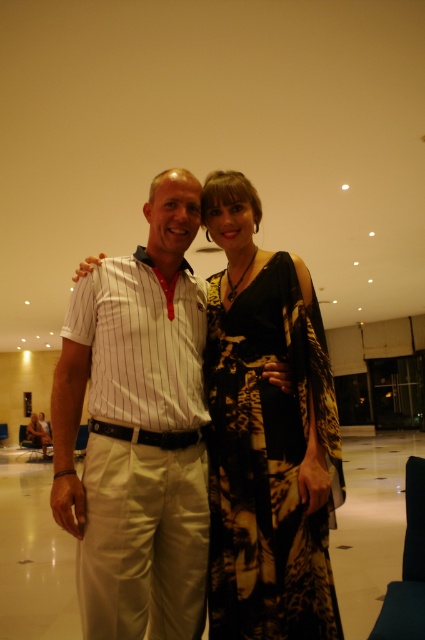
Question: Can you confirm if white striped shirt at center is wider than black printed dress at center?

Choices:
 (A) yes
 (B) no

Answer: (A)

Question: Among these objects, which one is farthest from the camera?

Choices:
 (A) black printed dress at center
 (B) white striped shirt at center

Answer: (A)

Question: Considering the relative positions of white striped shirt at center and black printed dress at center in the image provided, where is white striped shirt at center located with respect to black printed dress at center?

Choices:
 (A) above
 (B) below

Answer: (A)

Question: Is white striped shirt at center smaller than black printed dress at center?

Choices:
 (A) no
 (B) yes

Answer: (A)

Question: Which point appears closest to the camera in this image?

Choices:
 (A) (133, 577)
 (B) (283, 513)

Answer: (A)